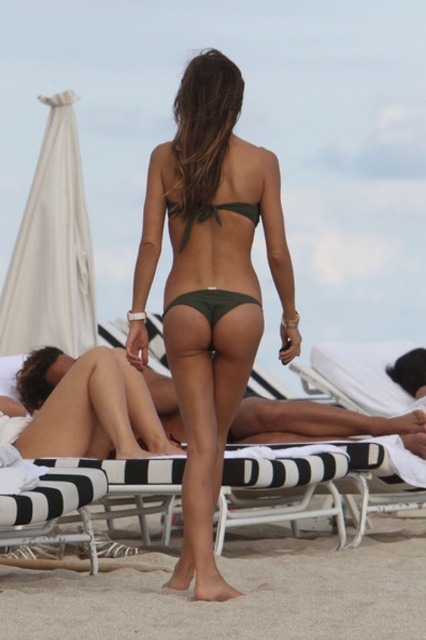
Between sandy beach at lower center and green matte bikini at center, which one has less height?

sandy beach at lower center is shorter.

Between sandy beach at lower center and green matte bikini at center, which one is positioned higher?

Positioned higher is green matte bikini at center.

Find the location of a particular element. sandy beach at lower center is located at coordinates (236, 598).

Where is `sandy beach at lower center`? sandy beach at lower center is located at coordinates (236, 598).

Can you confirm if black striped beach chair at center is positioned below green matte bikini at center?

Yes, black striped beach chair at center is below green matte bikini at center.

Can you confirm if black striped beach chair at center is positioned to the right of green matte bikini at center?

Indeed, black striped beach chair at center is positioned on the right side of green matte bikini at center.

The width and height of the screenshot is (426, 640). I want to click on black striped beach chair at center, so tap(282, 488).

Does green matte bikini at center appear on the right side of green matte bikini top at center?

No, green matte bikini at center is not to the right of green matte bikini top at center.

Between green matte bikini at center and green matte bikini top at center, which one is positioned higher?

Positioned higher is green matte bikini top at center.

Identify the location of green matte bikini at center. The width and height of the screenshot is (426, 640). (212, 301).